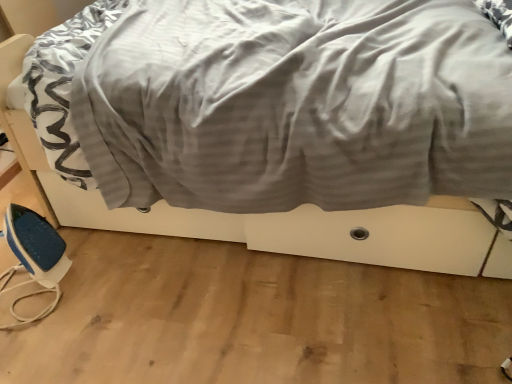
Question: Do you think white fabric bed at center is within blue plastic iron at lower left, or outside of it?

Choices:
 (A) inside
 (B) outside

Answer: (B)

Question: In terms of height, does white fabric bed at center look taller or shorter compared to blue plastic iron at lower left?

Choices:
 (A) tall
 (B) short

Answer: (A)

Question: Is white fabric bed at center bigger or smaller than blue plastic iron at lower left?

Choices:
 (A) small
 (B) big

Answer: (B)

Question: Is blue plastic iron at lower left taller or shorter than white fabric bed at center?

Choices:
 (A) short
 (B) tall

Answer: (A)

Question: Is blue plastic iron at lower left in front of or behind white fabric bed at center in the image?

Choices:
 (A) front
 (B) behind

Answer: (B)

Question: From a real-world perspective, is blue plastic iron at lower left above or below white fabric bed at center?

Choices:
 (A) below
 (B) above

Answer: (A)

Question: Is blue plastic iron at lower left wider or thinner than white fabric bed at center?

Choices:
 (A) thin
 (B) wide

Answer: (A)